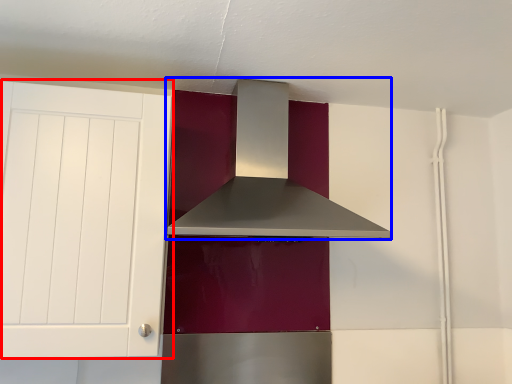
Question: Among these objects, which one is farthest to the camera, cabinetry (highlighted by a red box) or home appliance (highlighted by a blue box)?

Choices:
 (A) cabinetry
 (B) home appliance

Answer: (B)